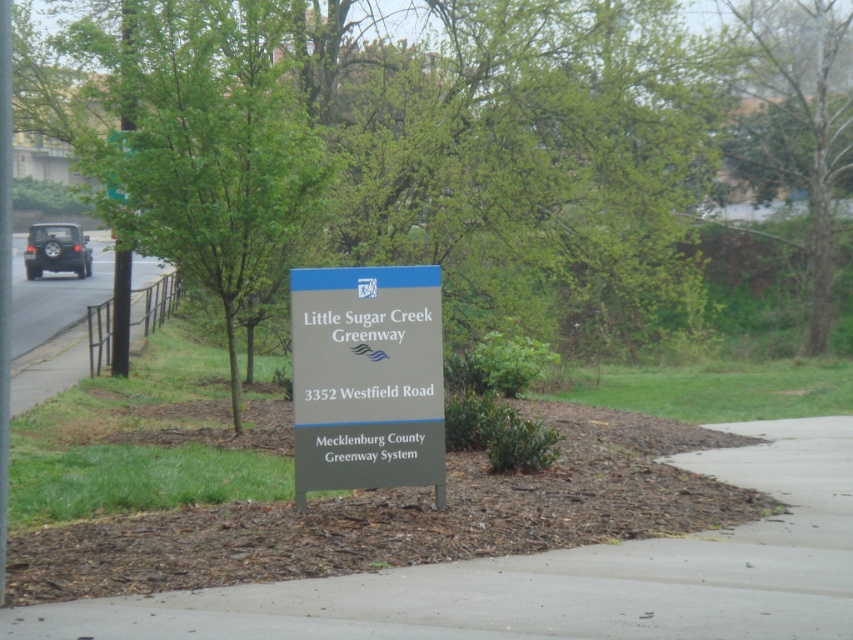
Is black asphalt pavement at left taller than black matte suv at left?

Yes.

Is point (70, 337) in front of point (67, 269)?

Yes, point (70, 337) is in front of point (67, 269).

Does point (18, 378) lie behind point (35, 240)?

No, it is not.

This screenshot has height=640, width=853. What are the coordinates of `black asphalt pavement at left` in the screenshot? It's located at (56, 336).

Between metallic gray sign at center and green leafy tree at upper right, which one has more height?

With more height is green leafy tree at upper right.

Who is more distant from viewer, (438, 448) or (778, 38)?

Positioned behind is point (778, 38).

Find the location of `metallic gray sign at center`. metallic gray sign at center is located at coordinates (366, 378).

The width and height of the screenshot is (853, 640). What are the coordinates of `black asphalt pavement at left` in the screenshot? It's located at (56, 336).

Who is more forward, (22, 340) or (111, 179)?

Point (111, 179) is more forward.

Measure the distance between point (44,346) and camera.

The distance of point (44,346) from camera is 30.31 meters.

The width and height of the screenshot is (853, 640). What are the coordinates of `black asphalt pavement at left` in the screenshot? It's located at (56, 336).